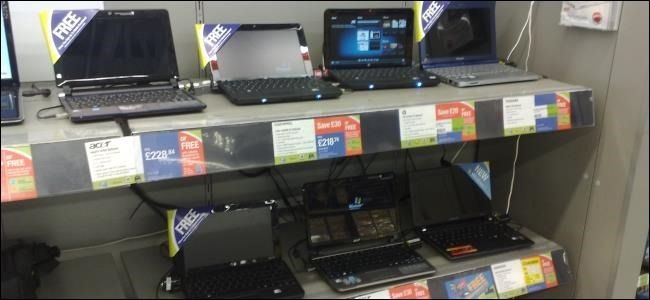
Identify the location of wall. This screenshot has width=650, height=300. (566, 44), (559, 188).